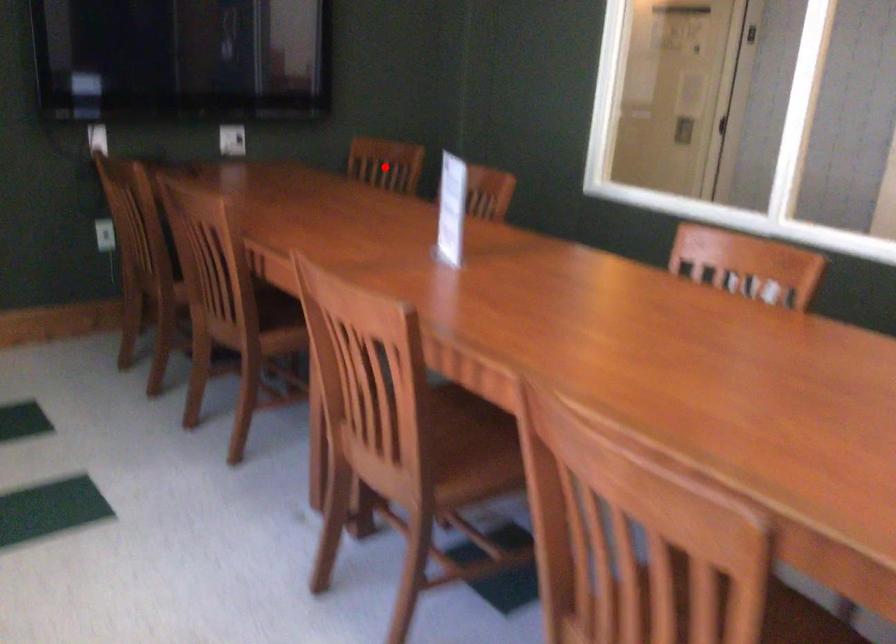
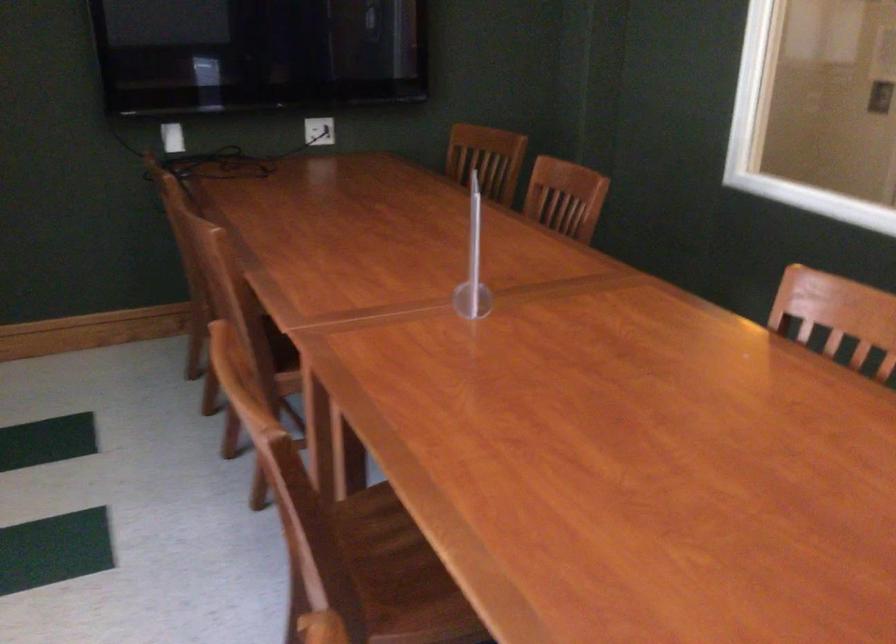
In the second image, find the point that corresponds to the highlighted location in the first image.

(487, 158)